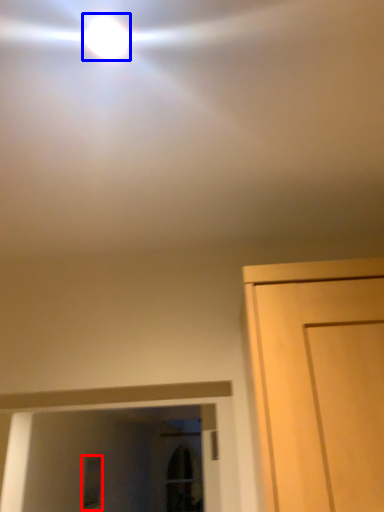
Question: Among these objects, which one is nearest to the camera, window (highlighted by a red box) or droplight (highlighted by a blue box)?

Choices:
 (A) window
 (B) droplight

Answer: (B)